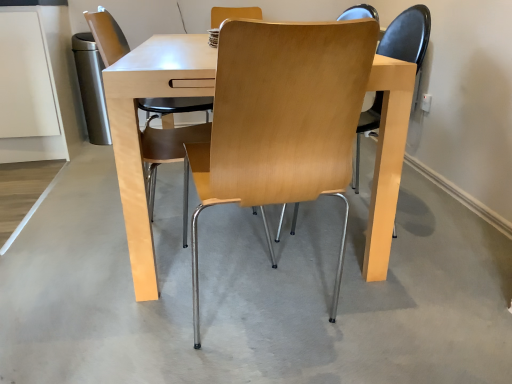
Locate an element on the screen. free space above light gray concrete at center (from a real-world perspective) is located at coordinates (202, 235).